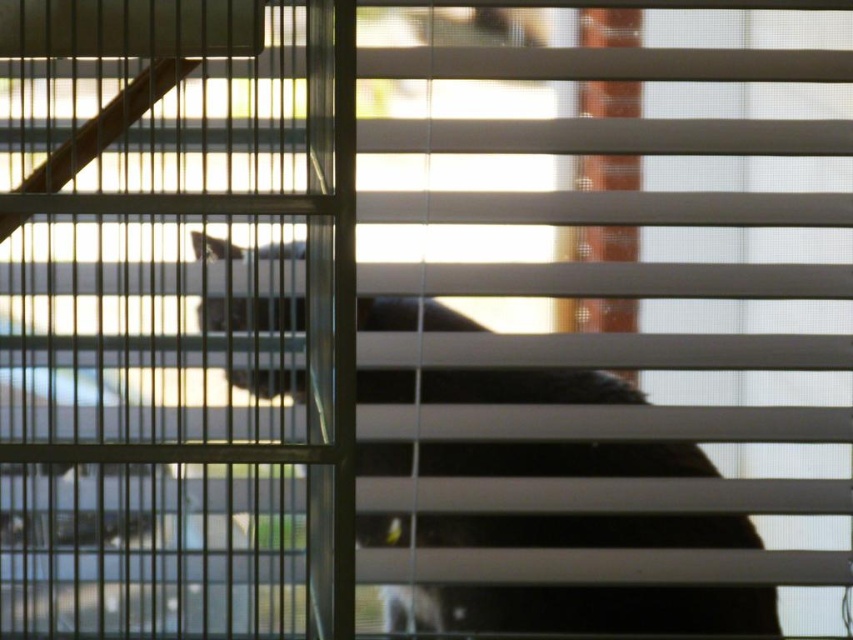
Does metallic silver screen door at upper left appear under fluffy black cat at center?

Actually, metallic silver screen door at upper left is above fluffy black cat at center.

Who is positioned more to the left, metallic silver screen door at upper left or fluffy black cat at center?

Positioned to the left is metallic silver screen door at upper left.

The width and height of the screenshot is (853, 640). What do you see at coordinates (170, 317) in the screenshot?
I see `metallic silver screen door at upper left` at bounding box center [170, 317].

Where is `metallic silver screen door at upper left`? metallic silver screen door at upper left is located at coordinates (170, 317).